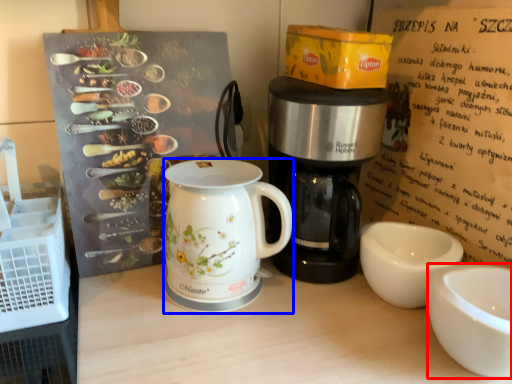
Question: Which object is closer to the camera taking this photo, coffee cup (highlighted by a red box) or jug (highlighted by a blue box)?

Choices:
 (A) coffee cup
 (B) jug

Answer: (A)